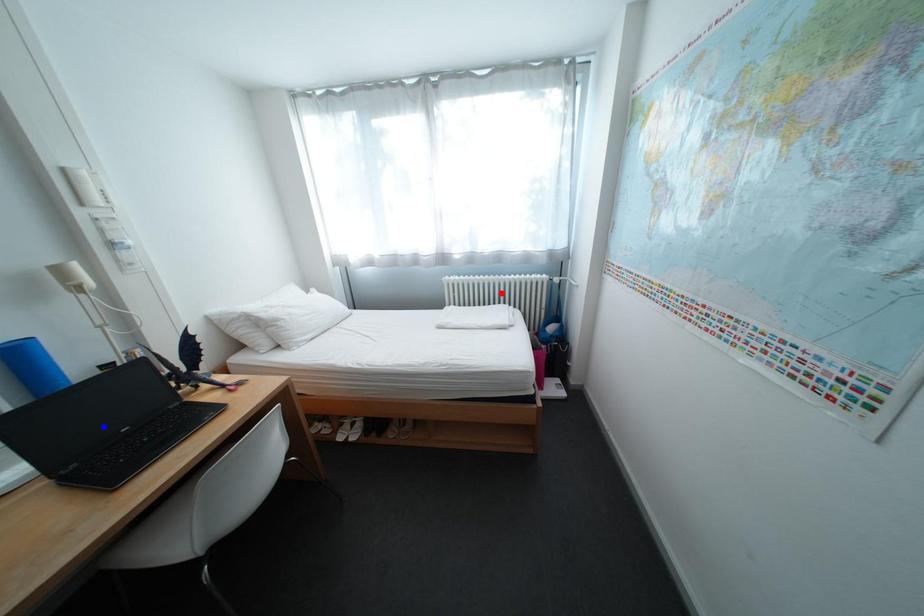
Question: Which of the two points in the image is closer to the camera?

Choices:
 (A) Blue point is closer.
 (B) Red point is closer.

Answer: (A)